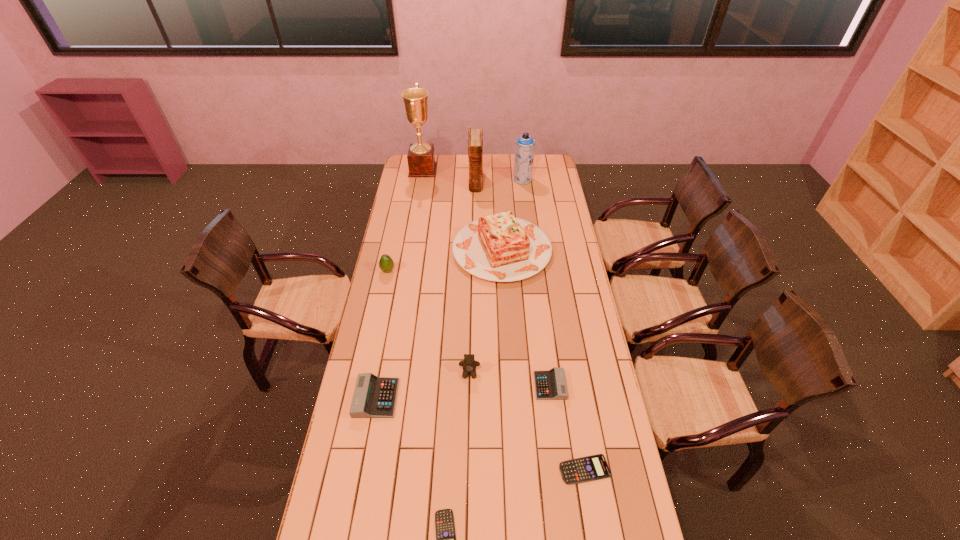
Locate an element on the screen. The width and height of the screenshot is (960, 540). object located at the far left corner is located at coordinates click(x=421, y=157).

This screenshot has height=540, width=960. Find the location of `object present at the far right corner`. object present at the far right corner is located at coordinates (525, 145).

In the image, there is a desktop. Where is `free space at the far edge`? free space at the far edge is located at coordinates (495, 164).

I want to click on free region at the left edge of the desktop, so click(x=398, y=288).

Identify the location of vacant space at the right edge of the desktop. This screenshot has width=960, height=540. (563, 249).

The image size is (960, 540). I want to click on free space between the hardback book and the green avocado, so click(x=432, y=226).

The height and width of the screenshot is (540, 960). Identify the location of vacant area between the hardback book and the ninth farthest object. [x=530, y=326].

This screenshot has width=960, height=540. I want to click on vacant area between the blue aerosol can and the right gray calculator, so (x=537, y=282).

Where is `free spot between the bigger blue calculator and the tallest object`? This screenshot has width=960, height=540. free spot between the bigger blue calculator and the tallest object is located at coordinates (504, 320).

You are a GUI agent. You are given a task and a screenshot of the screen. Output one action in this format:
    pyautogui.click(x=<x>, y=<y>)
    Task: Click on the vacant space that's between the tallest calculator and the avocado
    
    Given the screenshot: What is the action you would take?
    pyautogui.click(x=382, y=334)